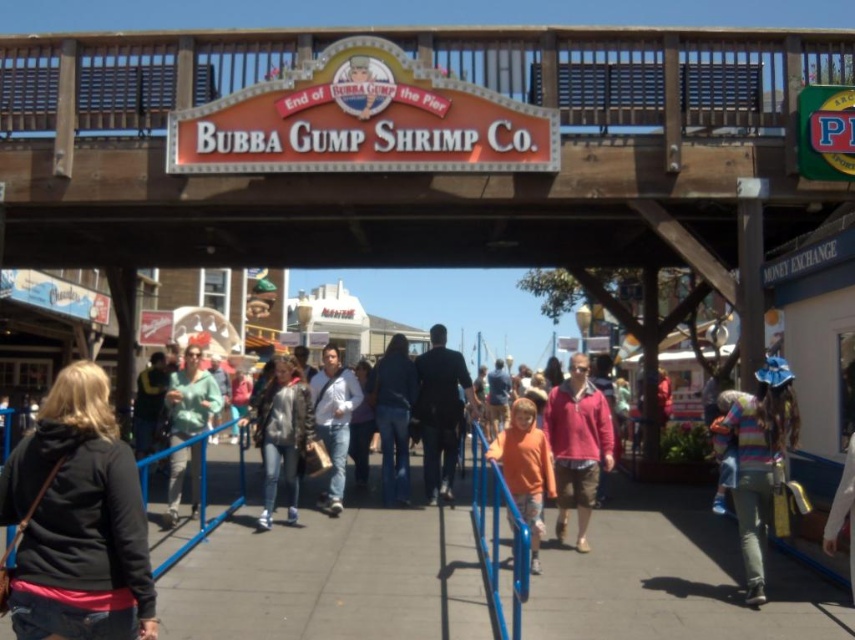
Question: Can you confirm if gray concrete pavement at center is positioned to the left of orange cotton shirt at center?

Choices:
 (A) no
 (B) yes

Answer: (B)

Question: Which of the following is the closest to the observer?

Choices:
 (A) leather jacket at center
 (B) black fleece jacket at lower left
 (C) denim pants at center
 (D) dark blue suit at center

Answer: (B)

Question: Which of these objects is positioned closest to the striped wool sweater at lower right?

Choices:
 (A) white matte shirt at center
 (B) gray concrete pavement at center
 (C) blue metal rail at center

Answer: (B)

Question: Which object is the farthest from the denim pants at center?

Choices:
 (A) orange cotton shirt at center
 (B) matte green sweater at center
 (C) blue metal rail at center
 (D) pink matte sweater at center

Answer: (C)

Question: Is black fleece jacket at lower left to the right of white matte shirt at center from the viewer's perspective?

Choices:
 (A) no
 (B) yes

Answer: (A)

Question: Is gray concrete pavement at center to the right of black fleece jacket at lower left from the viewer's perspective?

Choices:
 (A) yes
 (B) no

Answer: (A)